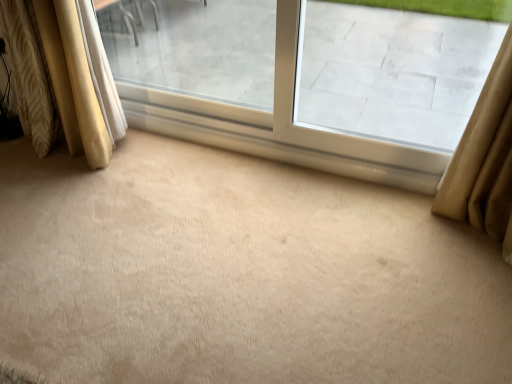
Question: Looking at their shapes, would you say transparent glass window at upper right is wider or thinner than beige fabric curtain at left, the second curtain when ordered from left to right?

Choices:
 (A) wide
 (B) thin

Answer: (B)

Question: Does point (310, 84) appear closer or farther from the camera than point (17, 97)?

Choices:
 (A) farther
 (B) closer

Answer: (A)

Question: Which of these objects is positioned farthest from the transparent glass window at center?

Choices:
 (A) woven fabric curtain at left, acting as the 2th curtain starting from the right
 (B) beige fabric curtain at left, arranged as the 1th curtain when viewed from the right
 (C) transparent glass window at upper right

Answer: (A)

Question: Which object is positioned closest to the woven fabric curtain at left, which is the 1th curtain in left-to-right order?

Choices:
 (A) transparent glass window at upper right
 (B) beige fabric curtain at left, arranged as the 1th curtain when viewed from the right
 (C) transparent glass window at center

Answer: (B)